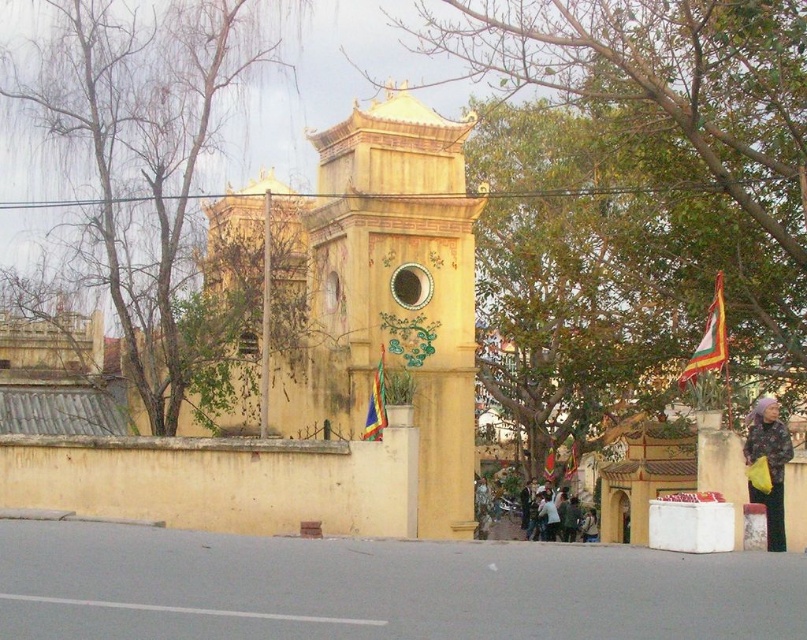
You are standing in front of the yellow matte bell tower at center and want to reach the dark gray fabric bag at lower right. Which direction should you move to get closer to the bag?

The yellow matte bell tower at center is to the left of the dark gray fabric bag at lower right, so you should move to the right to get closer to the dark gray fabric bag at lower right.

Consider the image. You are an architect visiting this historical site. You need to create a scale model of the scene. Which object, the yellow matte tower at center or the green leafy tree at upper left, should you make bigger in your model to accurately represent their sizes?

The yellow matte tower at center should be made bigger in the model since it is larger in size than the green leafy tree at upper left according to the description.

You are standing in front of the temple structure and notice the green leafy tree at center and the multicolored fabric flag at upper right. From your perspective, which object is positioned to the left of the other?

The green leafy tree at center is to the left of the multicolored fabric flag at upper right.